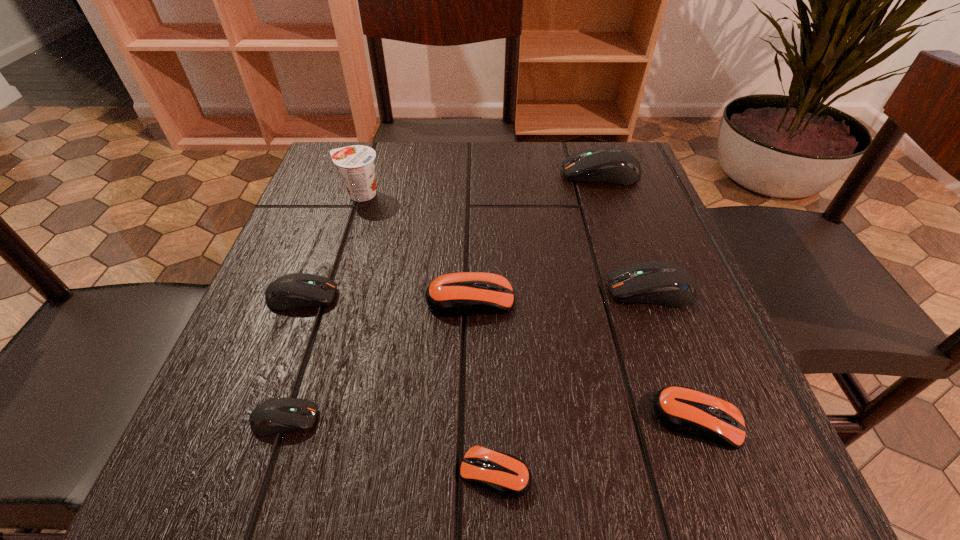
Where is `yogurt`? The image size is (960, 540). yogurt is located at coordinates (356, 165).

Identify the location of the farthest dark computer equipment. This screenshot has height=540, width=960. (611, 165).

You are a GUI agent. You are given a task and a screenshot of the screen. Output one action in this format:
    pyautogui.click(x=<x>, y=<y>)
    Task: Click on the second tallest object
    Image resolution: width=960 pixels, height=540 pixels.
    Given the screenshot: What is the action you would take?
    pyautogui.click(x=611, y=165)

The width and height of the screenshot is (960, 540). Identify the location of the second tallest computer mouse. (654, 282).

You are a GUI agent. You are given a task and a screenshot of the screen. Output one action in this format:
    pyautogui.click(x=<x>, y=<y>)
    Task: Click on the third smallest dark computer equipment
    The height and width of the screenshot is (540, 960).
    Given the screenshot: What is the action you would take?
    pyautogui.click(x=654, y=282)

Locate an element on the screen. the biggest orange computer mouse is located at coordinates (457, 294).

Identify the location of the second smallest dark computer equipment. (296, 290).

Where is `the rightmost orange computer mouse`? This screenshot has width=960, height=540. the rightmost orange computer mouse is located at coordinates (681, 409).

You are a GUI agent. You are given a task and a screenshot of the screen. Output one action in this format:
    pyautogui.click(x=<x>, y=<y>)
    Task: Click on the nearest dark computer equipment
    
    Given the screenshot: What is the action you would take?
    pyautogui.click(x=284, y=414)

Locate an element on the screen. the shortest object is located at coordinates (506, 475).